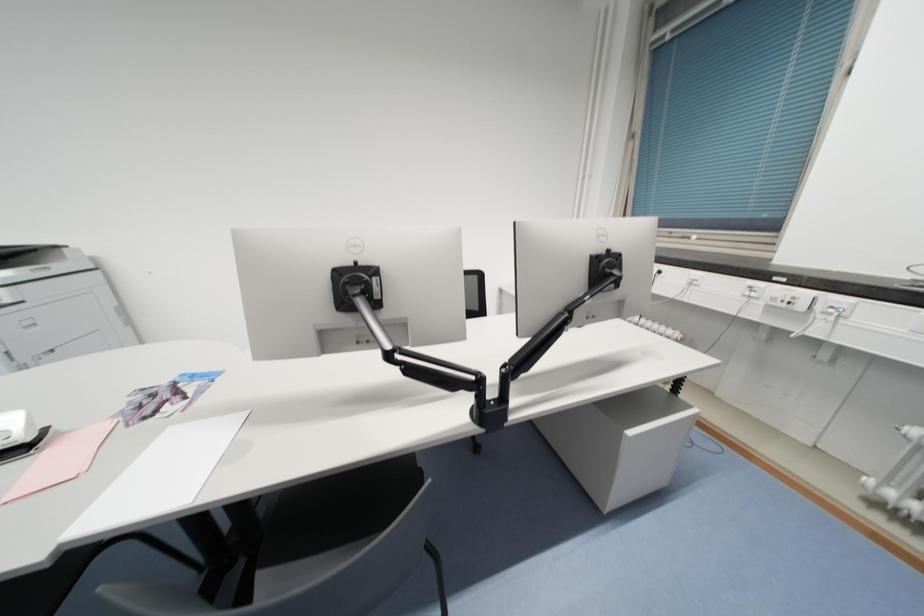
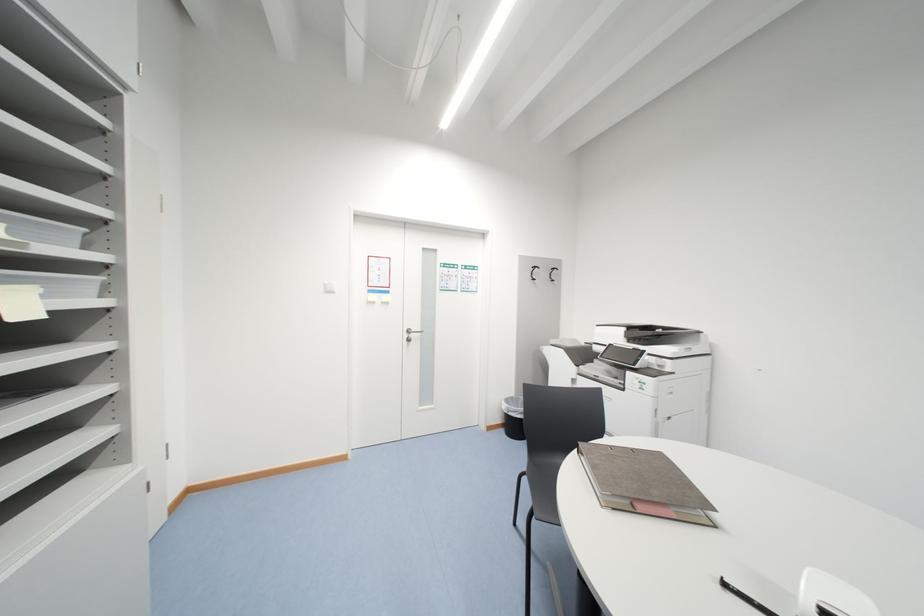
Question: The camera is either moving clockwise (left) or counter-clockwise (right) around the object. The first image is from the beginning of the video and the second image is from the end. Is the camera moving left or right when shooting the video?

Choices:
 (A) Left
 (B) Right

Answer: (B)